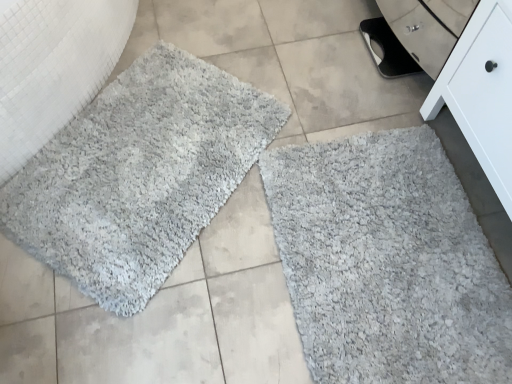
Describe the element at coordinates (53, 67) in the screenshot. I see `gray shaggy rug at left` at that location.

At what (x,y) coordinates should I click in order to perform the action: click on gray shaggy bath mat at lower right, marked as the second bath mat in a left-to-right arrangement. Please return your answer as a coordinate pair (x, y). Looking at the image, I should click on pos(387,262).

What do you see at coordinates (482, 92) in the screenshot? The image size is (512, 384). I see `white matte cabinet at lower right` at bounding box center [482, 92].

Image resolution: width=512 pixels, height=384 pixels. Identify the location of gray shaggy rug at left. (53, 67).

In terms of width, does gray shaggy rug at upper left, acting as the 1th bath mat starting from the left, look wider or thinner when compared to gray shaggy bath mat at lower right, marked as the second bath mat in a left-to-right arrangement?

Considering their sizes, gray shaggy rug at upper left, acting as the 1th bath mat starting from the left, looks broader than gray shaggy bath mat at lower right, marked as the second bath mat in a left-to-right arrangement.

Is gray shaggy rug at upper left, which is the second bath mat in right-to-left order, bigger than gray shaggy bath mat at lower right, which appears as the first bath mat when viewed from the right?

Yes, gray shaggy rug at upper left, which is the second bath mat in right-to-left order, is bigger than gray shaggy bath mat at lower right, which appears as the first bath mat when viewed from the right.

Measure the distance between gray shaggy rug at upper left, which is the second bath mat in right-to-left order, and gray shaggy bath mat at lower right, which appears as the first bath mat when viewed from the right.

A distance of 49.12 centimeters exists between gray shaggy rug at upper left, which is the second bath mat in right-to-left order, and gray shaggy bath mat at lower right, which appears as the first bath mat when viewed from the right.

There is a white matte cabinet at lower right. At what (x,y) coordinates should I click in order to perform the action: click on the 1st bath mat below it (from a real-world perspective). Please return your answer as a coordinate pair (x, y). Looking at the image, I should click on point(387,262).

Does white matte cabinet at lower right appear on the right side of gray shaggy bath mat at lower right, marked as the second bath mat in a left-to-right arrangement?

Correct, you'll find white matte cabinet at lower right to the right of gray shaggy bath mat at lower right, marked as the second bath mat in a left-to-right arrangement.

Would you consider white matte cabinet at lower right to be distant from gray shaggy bath mat at lower right, marked as the second bath mat in a left-to-right arrangement?

That's not correct — white matte cabinet at lower right is a little close to gray shaggy bath mat at lower right, marked as the second bath mat in a left-to-right arrangement.

Based on their sizes in the image, would you say white matte cabinet at lower right is bigger or smaller than gray shaggy bath mat at lower right, which appears as the first bath mat when viewed from the right?

Clearly, white matte cabinet at lower right is larger in size than gray shaggy bath mat at lower right, which appears as the first bath mat when viewed from the right.

The height and width of the screenshot is (384, 512). What are the coordinates of `granite above the gray shaggy bath mat at lower right, marked as the second bath mat in a left-to-right arrangement (from the image's perspective)` in the screenshot? It's located at (53, 67).

Considering the sizes of objects gray shaggy bath mat at lower right, which appears as the first bath mat when viewed from the right, and gray shaggy rug at left in the image provided, who is wider, gray shaggy bath mat at lower right, which appears as the first bath mat when viewed from the right, or gray shaggy rug at left?

gray shaggy bath mat at lower right, which appears as the first bath mat when viewed from the right, is wider.

Can you confirm if gray shaggy bath mat at lower right, which appears as the first bath mat when viewed from the right, is taller than gray shaggy rug at left?

No.

From a real-world perspective, is gray shaggy bath mat at lower right, which appears as the first bath mat when viewed from the right, located beneath gray shaggy rug at left?

Indeed, from a real-world perspective, gray shaggy bath mat at lower right, which appears as the first bath mat when viewed from the right, is positioned beneath gray shaggy rug at left.

From the image's perspective, who appears lower, gray shaggy rug at left or gray shaggy rug at upper left, acting as the 1th bath mat starting from the left?

gray shaggy rug at upper left, acting as the 1th bath mat starting from the left.

Is gray shaggy rug at left not within gray shaggy rug at upper left, which is the second bath mat in right-to-left order?

Indeed, gray shaggy rug at left is completely outside gray shaggy rug at upper left, which is the second bath mat in right-to-left order.

In the scene shown: Can you tell me how much gray shaggy rug at left and gray shaggy rug at upper left, which is the second bath mat in right-to-left order, differ in facing direction?

The angular difference between gray shaggy rug at left and gray shaggy rug at upper left, which is the second bath mat in right-to-left order, is 48.9 degrees.

Between gray shaggy rug at left and gray shaggy rug at upper left, acting as the 1th bath mat starting from the left, which one has less height?

Standing shorter between the two is gray shaggy rug at upper left, acting as the 1th bath mat starting from the left.

Does gray shaggy bath mat at lower right, marked as the second bath mat in a left-to-right arrangement, have a greater width compared to white matte cabinet at lower right?

Correct, the width of gray shaggy bath mat at lower right, marked as the second bath mat in a left-to-right arrangement, exceeds that of white matte cabinet at lower right.

From a real-world perspective, is gray shaggy bath mat at lower right, which appears as the first bath mat when viewed from the right, above or below white matte cabinet at lower right?

In terms of real-world spatial position, gray shaggy bath mat at lower right, which appears as the first bath mat when viewed from the right, is below white matte cabinet at lower right.

Based on the photo, from their relative heights in the image, would you say gray shaggy bath mat at lower right, which appears as the first bath mat when viewed from the right, is taller or shorter than white matte cabinet at lower right?

Considering their sizes, gray shaggy bath mat at lower right, which appears as the first bath mat when viewed from the right, has less height than white matte cabinet at lower right.

Can you confirm if white matte cabinet at lower right is shorter than gray shaggy rug at upper left, which is the second bath mat in right-to-left order?

No, white matte cabinet at lower right is not shorter than gray shaggy rug at upper left, which is the second bath mat in right-to-left order.

Does point (433, 106) come farther from viewer compared to point (24, 239)?

Yes, point (433, 106) is behind point (24, 239).

From the image's perspective, between white matte cabinet at lower right and gray shaggy rug at upper left, acting as the 1th bath mat starting from the left, which one is located above?

white matte cabinet at lower right is shown above in the image.

Which is more to the left, white matte cabinet at lower right or gray shaggy rug at upper left, acting as the 1th bath mat starting from the left?

gray shaggy rug at upper left, acting as the 1th bath mat starting from the left.

Considering the sizes of objects white matte cabinet at lower right and gray shaggy rug at left in the image provided, who is thinner, white matte cabinet at lower right or gray shaggy rug at left?

white matte cabinet at lower right.

From a real-world perspective, between white matte cabinet at lower right and gray shaggy rug at left, who is vertically lower?

In real-world perspective, gray shaggy rug at left is lower.

Consider the image. Considering the relative positions of white matte cabinet at lower right and gray shaggy rug at left in the image provided, is white matte cabinet at lower right to the right of gray shaggy rug at left from the viewer's perspective?

Indeed, white matte cabinet at lower right is positioned on the right side of gray shaggy rug at left.

Is white matte cabinet at lower right not close to gray shaggy rug at left?

white matte cabinet at lower right is far away from gray shaggy rug at left.

Locate an element on the screen. bath mat below the gray shaggy rug at upper left, which is the second bath mat in right-to-left order (from the image's perspective) is located at coordinates (387, 262).

I want to click on furniture in front of the gray shaggy bath mat at lower right, marked as the second bath mat in a left-to-right arrangement, so click(482, 92).

Estimate the real-world distances between objects in this image. Which object is closer to gray shaggy bath mat at lower right, marked as the second bath mat in a left-to-right arrangement, white matte cabinet at lower right or gray shaggy rug at left?

white matte cabinet at lower right lies closer to gray shaggy bath mat at lower right, marked as the second bath mat in a left-to-right arrangement, than the other object.

When comparing their distances from white matte cabinet at lower right, does gray shaggy bath mat at lower right, which appears as the first bath mat when viewed from the right, or gray shaggy rug at left seem closer?

gray shaggy bath mat at lower right, which appears as the first bath mat when viewed from the right, lies closer to white matte cabinet at lower right than the other object.

When comparing their distances from white matte cabinet at lower right, does gray shaggy bath mat at lower right, which appears as the first bath mat when viewed from the right, or gray shaggy rug at upper left, acting as the 1th bath mat starting from the left, seem closer?

The object closer to white matte cabinet at lower right is gray shaggy bath mat at lower right, which appears as the first bath mat when viewed from the right.

Which object lies nearer to the anchor point gray shaggy rug at left, gray shaggy rug at upper left, which is the second bath mat in right-to-left order, or white matte cabinet at lower right?

The object closer to gray shaggy rug at left is gray shaggy rug at upper left, which is the second bath mat in right-to-left order.

Looking at the image, which one is located closer to white matte cabinet at lower right, gray shaggy rug at upper left, acting as the 1th bath mat starting from the left, or gray shaggy rug at left?

gray shaggy rug at upper left, acting as the 1th bath mat starting from the left, is positioned closer to the anchor white matte cabinet at lower right.

Which object lies further to the anchor point gray shaggy rug at upper left, which is the second bath mat in right-to-left order, gray shaggy bath mat at lower right, marked as the second bath mat in a left-to-right arrangement, or gray shaggy rug at left?

The object further to gray shaggy rug at upper left, which is the second bath mat in right-to-left order, is gray shaggy bath mat at lower right, marked as the second bath mat in a left-to-right arrangement.

Considering their positions, is gray shaggy rug at left positioned closer to white matte cabinet at lower right than gray shaggy rug at upper left, which is the second bath mat in right-to-left order?

gray shaggy rug at upper left, which is the second bath mat in right-to-left order, is closer to white matte cabinet at lower right.

Looking at the image, which one is located further to gray shaggy rug at left, gray shaggy bath mat at lower right, marked as the second bath mat in a left-to-right arrangement, or white matte cabinet at lower right?

white matte cabinet at lower right is positioned further to the anchor gray shaggy rug at left.

Locate an element on the screen. The height and width of the screenshot is (384, 512). bath mat between gray shaggy rug at left and gray shaggy bath mat at lower right, which appears as the first bath mat when viewed from the right is located at coordinates (139, 175).

I want to click on bath mat situated between gray shaggy rug at upper left, acting as the 1th bath mat starting from the left, and white matte cabinet at lower right from left to right, so click(387, 262).